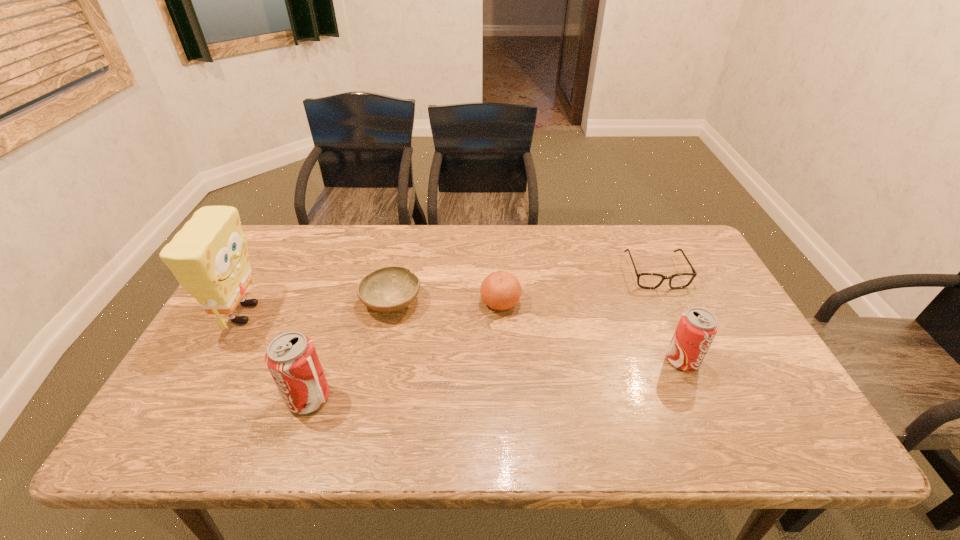
Where is `vacant space that satisfies the following two spatial constraints: 1. on the face of the tallest object; 2. on the left side of the farther soda can`? This screenshot has width=960, height=540. vacant space that satisfies the following two spatial constraints: 1. on the face of the tallest object; 2. on the left side of the farther soda can is located at coordinates (218, 360).